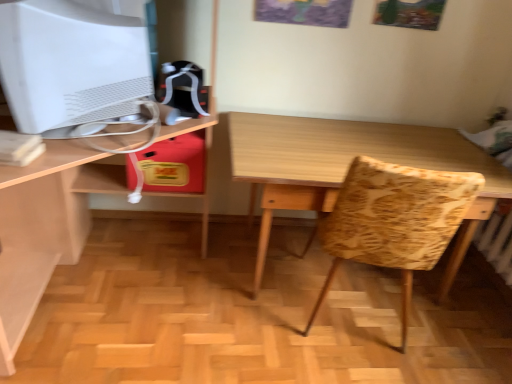
Question: Is white matte computer monitor at upper left behind wooden table at center?

Choices:
 (A) no
 (B) yes

Answer: (A)

Question: Is white matte computer monitor at upper left in front of wooden table at center?

Choices:
 (A) yes
 (B) no

Answer: (A)

Question: Does white matte computer monitor at upper left appear on the left side of wooden table at center?

Choices:
 (A) no
 (B) yes

Answer: (B)

Question: Is white matte computer monitor at upper left outside wooden table at center?

Choices:
 (A) no
 (B) yes

Answer: (B)

Question: From a real-world perspective, is white matte computer monitor at upper left below wooden table at center?

Choices:
 (A) yes
 (B) no

Answer: (B)

Question: Does white matte computer monitor at upper left have a larger size compared to wooden table at center?

Choices:
 (A) no
 (B) yes

Answer: (A)

Question: Can you confirm if wooden desk at center is shorter than wooden table at center?

Choices:
 (A) no
 (B) yes

Answer: (A)

Question: Is wooden desk at center not close to wooden table at center?

Choices:
 (A) no
 (B) yes

Answer: (B)

Question: Does wooden desk at center appear on the right side of wooden table at center?

Choices:
 (A) no
 (B) yes

Answer: (A)

Question: Can you confirm if wooden desk at center is taller than wooden table at center?

Choices:
 (A) yes
 (B) no

Answer: (A)

Question: Is the position of wooden desk at center less distant than that of wooden table at center?

Choices:
 (A) no
 (B) yes

Answer: (B)

Question: Is wooden desk at center oriented away from wooden table at center?

Choices:
 (A) yes
 (B) no

Answer: (B)

Question: Can you confirm if wooden table at center is positioned to the left of wooden desk at center?

Choices:
 (A) yes
 (B) no

Answer: (B)